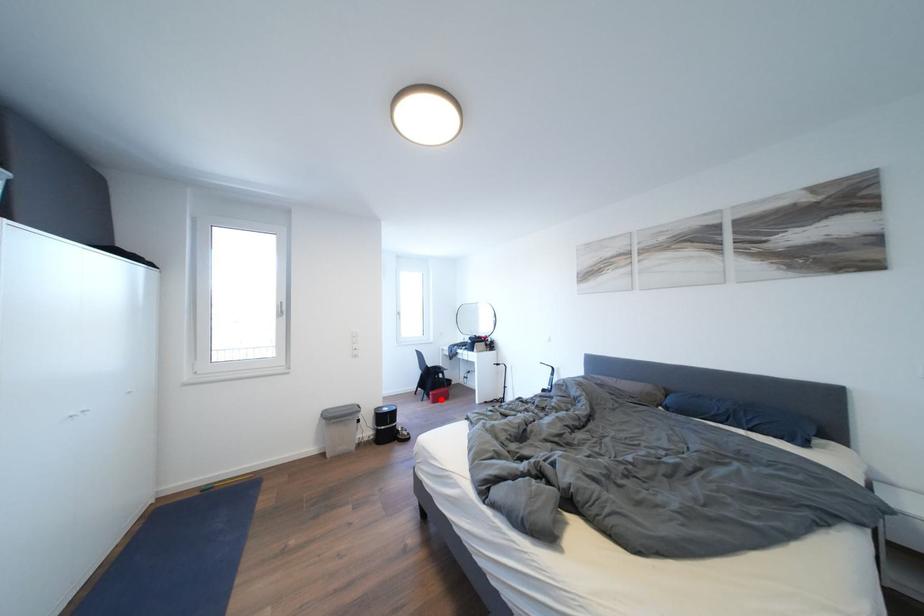
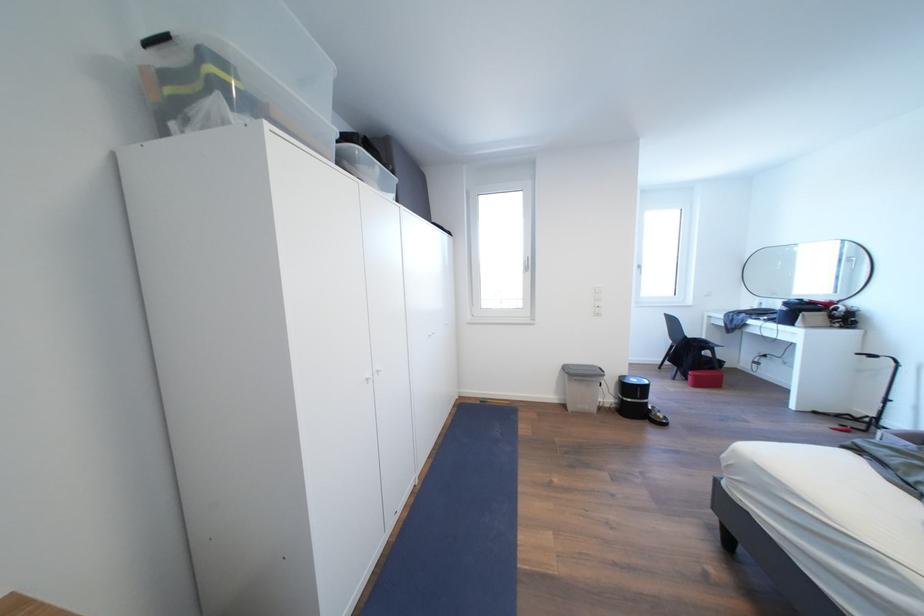
Question: I am providing you with two images of the same scene from different viewpoints. A red point is shown in image1. For the corresponding object point in image2, is it positioned nearer or farther from the camera?

Choices:
 (A) Nearer
 (B) Farther

Answer: (A)